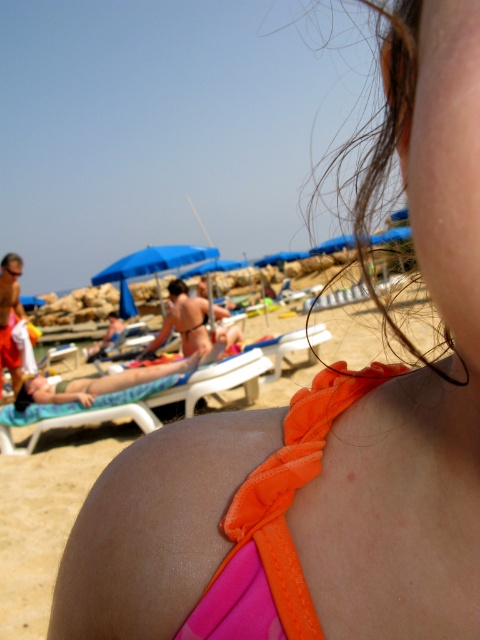
You are a photographer trying to capture a shot of the orange fabric bikini top at upper center and the green plastic beach chair at lower left. Which object appears smaller in the photo?

The orange fabric bikini top at upper center appears smaller in the photo because it has a smaller size compared to the green plastic beach chair at lower left.